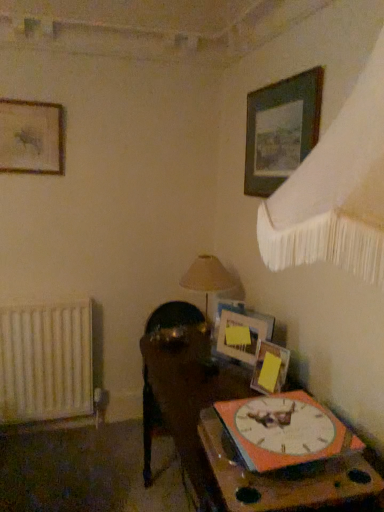
I want to click on blank space above orange matte wall clock at lower right (from a real-world perspective), so click(x=283, y=422).